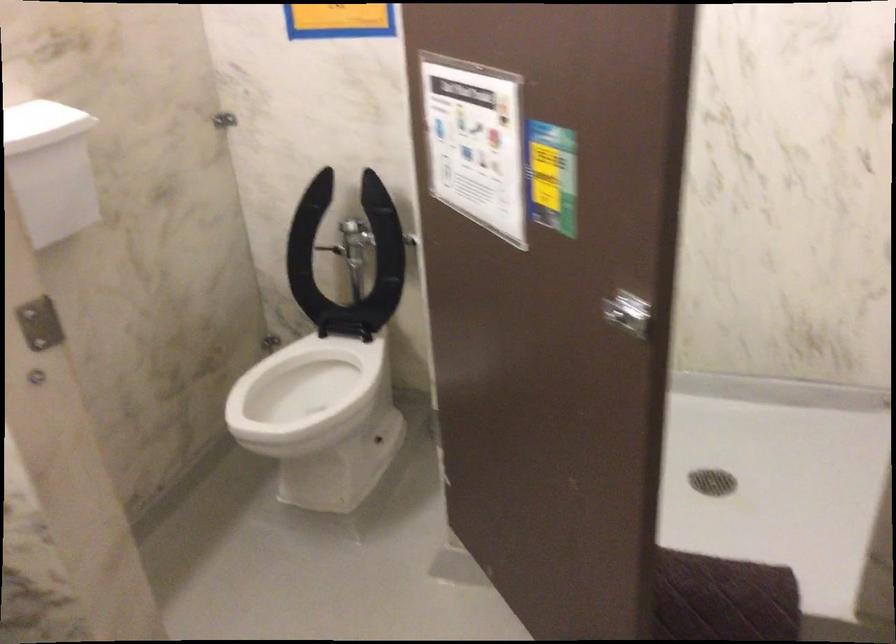
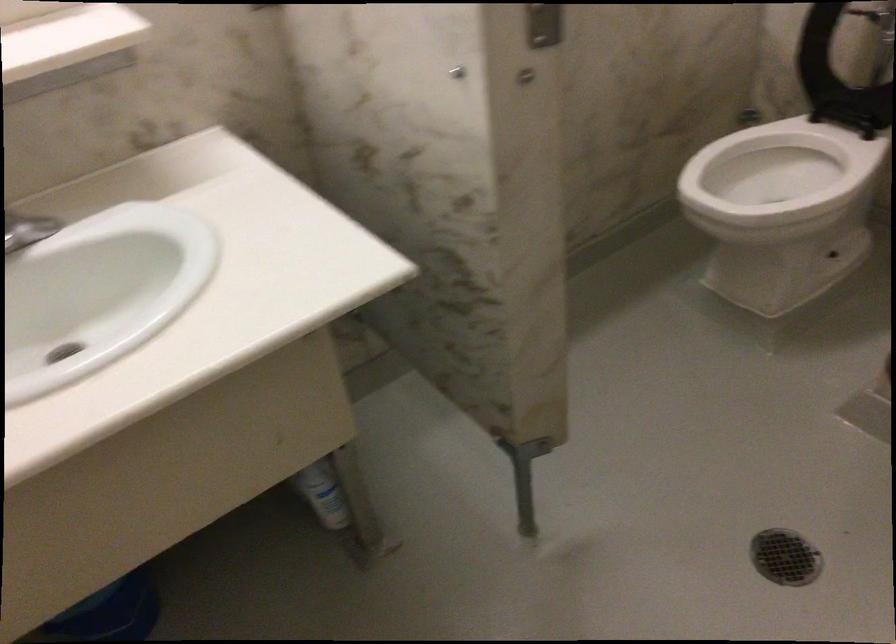
The point at (316, 384) is marked in the first image. Where is the corresponding point in the second image?

(778, 173)